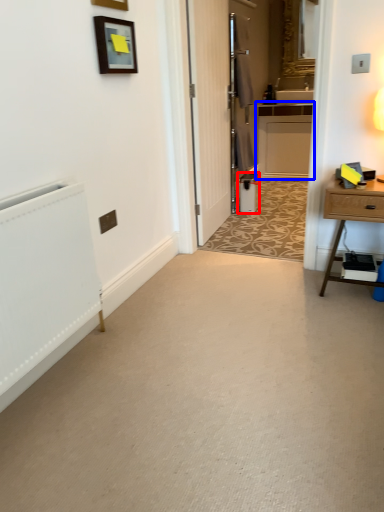
Question: Which point is closer to the camera, appliance (highlighted by a red box) or cabinetry (highlighted by a blue box)?

Choices:
 (A) appliance
 (B) cabinetry

Answer: (A)